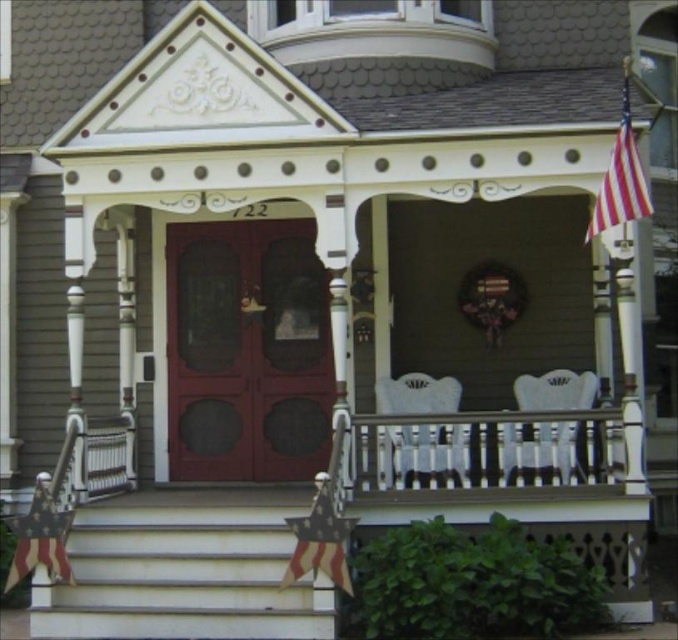
At what (x,y) coordinates should I click in order to perform the action: click on polyester flag at lower center. Please return your answer as a coordinate pair (x, y). The height and width of the screenshot is (640, 678). Looking at the image, I should click on (319, 540).

Which is more to the left, polyester flag at lower center or american flag at lower left?

american flag at lower left is more to the left.

Who is more distant from viewer, (334, 538) or (28, 532)?

Point (28, 532)

This screenshot has height=640, width=678. Identify the location of polyester flag at lower center. (319, 540).

Is point (319, 476) positioned in front of point (616, 173)?

Yes, it is.

You are a GUI agent. You are given a task and a screenshot of the screen. Output one action in this format:
    pyautogui.click(x=<x>, y=<y>)
    Task: Click on the polyester flag at lower center
    
    Given the screenshot: What is the action you would take?
    pyautogui.click(x=319, y=540)

Identify the location of polyester flag at lower center. This screenshot has width=678, height=640. (319, 540).

Could you measure the distance between white painted wood stairs at lower center and red striped fabric flag at upper right?

A distance of 6.38 meters exists between white painted wood stairs at lower center and red striped fabric flag at upper right.

Is white painted wood stairs at lower center thinner than red striped fabric flag at upper right?

In fact, white painted wood stairs at lower center might be wider than red striped fabric flag at upper right.

Find the location of a particular element. Image resolution: width=678 pixels, height=640 pixels. white painted wood stairs at lower center is located at coordinates (184, 568).